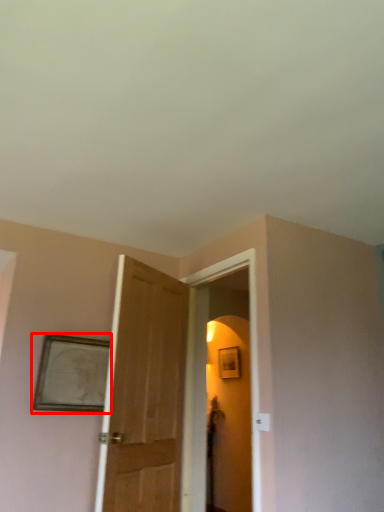
Question: From the image's perspective, what is the correct spatial relationship of picture frame (annotated by the red box) in relation to screen door?

Choices:
 (A) above
 (B) below

Answer: (A)